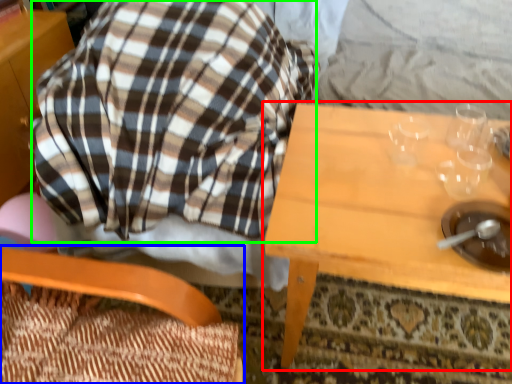
Question: Based on their relative distances, which object is nearer to table (highlighted by a red box)? Choose from chair (highlighted by a blue box) and flannel (highlighted by a green box).

Choices:
 (A) chair
 (B) flannel

Answer: (B)